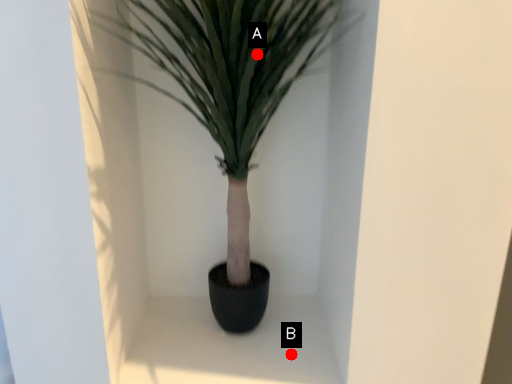
Question: Two points are circled on the image, labeled by A and B beside each circle. Which of the following is the farthest from the observer?

Choices:
 (A) A is further
 (B) B is further

Answer: (B)